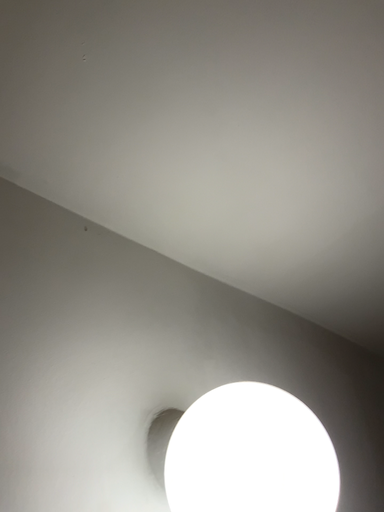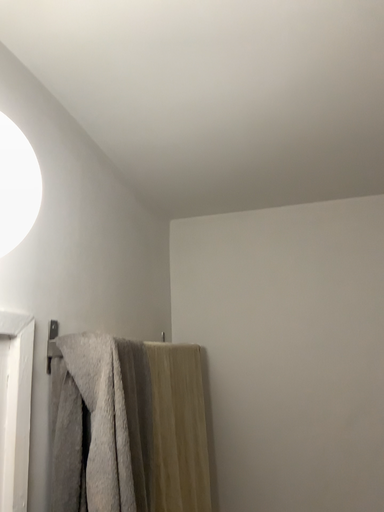
Question: Which way did the camera rotate in the video?

Choices:
 (A) rotated downward
 (B) rotated upward

Answer: (A)